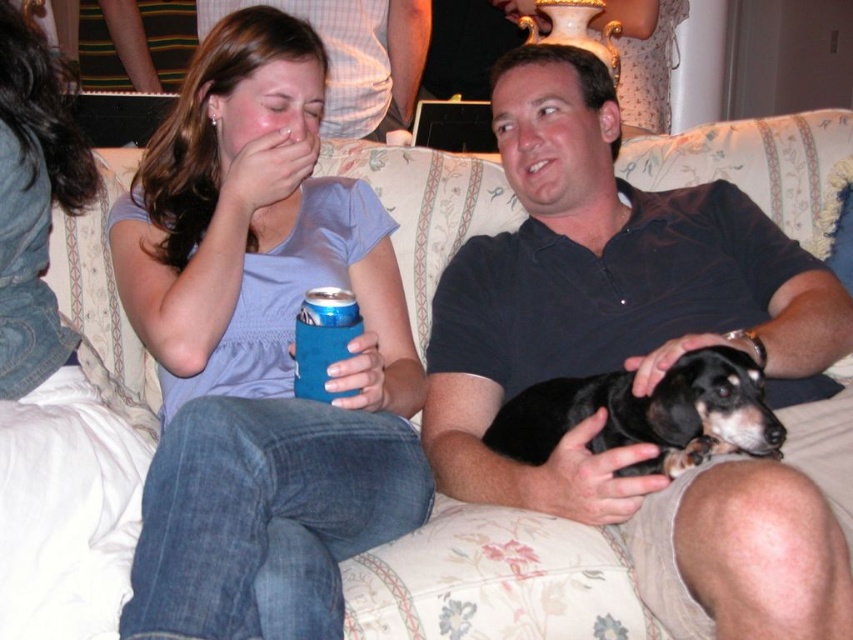
Locate an element on the screen. black smooth shirt at center is located at coordinates (647, 364).

Between point (474, 324) and point (305, 221), which one is positioned in front?

Point (305, 221)

The width and height of the screenshot is (853, 640). What do you see at coordinates (647, 364) in the screenshot? I see `black smooth shirt at center` at bounding box center [647, 364].

What are the coordinates of `black smooth shirt at center` in the screenshot? It's located at (647, 364).

Between point (248, 563) and point (518, 422), which one is positioned behind?

The point (518, 422) is behind.

Which is in front, point (248, 256) or point (523, 413)?

Positioned in front is point (523, 413).

Who is more forward, (167,476) or (683,372)?

Point (167,476) is in front.

Locate an element on the screen. This screenshot has width=853, height=640. matte blue fabric can cooler at left is located at coordinates (260, 352).

Between black smooth shirt at center and black smooth dog at center, which one has more height?

With more height is black smooth shirt at center.

Is black smooth shirt at center to the right of black smooth dog at center from the viewer's perspective?

Indeed, black smooth shirt at center is positioned on the right side of black smooth dog at center.

Which is in front, point (612, 486) or point (518, 456)?

Point (612, 486)

Where is `black smooth shirt at center`? The width and height of the screenshot is (853, 640). black smooth shirt at center is located at coordinates (647, 364).